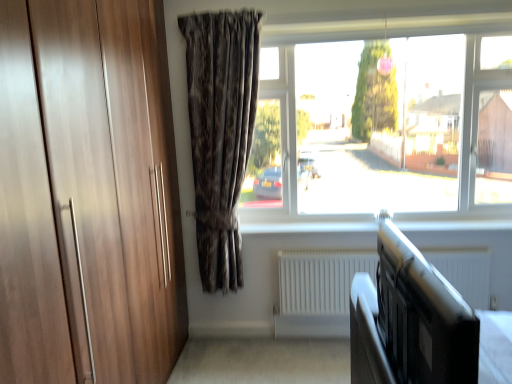
Question: Considering the positions of dark brown textured curtain at center and black matte bed frame at lower right in the image, is dark brown textured curtain at center taller or shorter than black matte bed frame at lower right?

Choices:
 (A) short
 (B) tall

Answer: (B)

Question: Is dark brown textured curtain at center to the left or to the right of black matte bed frame at lower right in the image?

Choices:
 (A) left
 (B) right

Answer: (A)

Question: Estimate the real-world distances between objects in this image. Which object is farther from the transparent glass window at center?

Choices:
 (A) white matte radiator at lower center
 (B) dark brown textured curtain at center
 (C) black matte bed frame at lower right

Answer: (C)

Question: Which object is positioned closest to the black matte bed frame at lower right?

Choices:
 (A) transparent glass window at center
 (B) dark brown textured curtain at center
 (C) white matte radiator at lower center

Answer: (C)